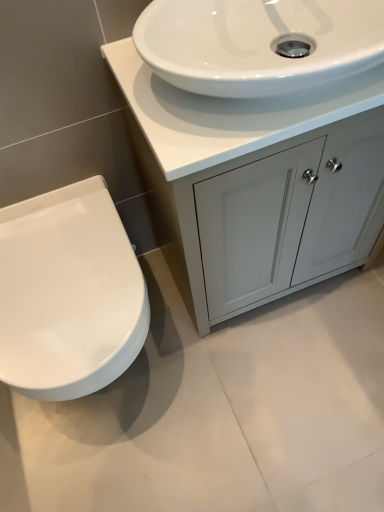
Locate an element on the screen. free space in front of white glossy toilet at left is located at coordinates (125, 464).